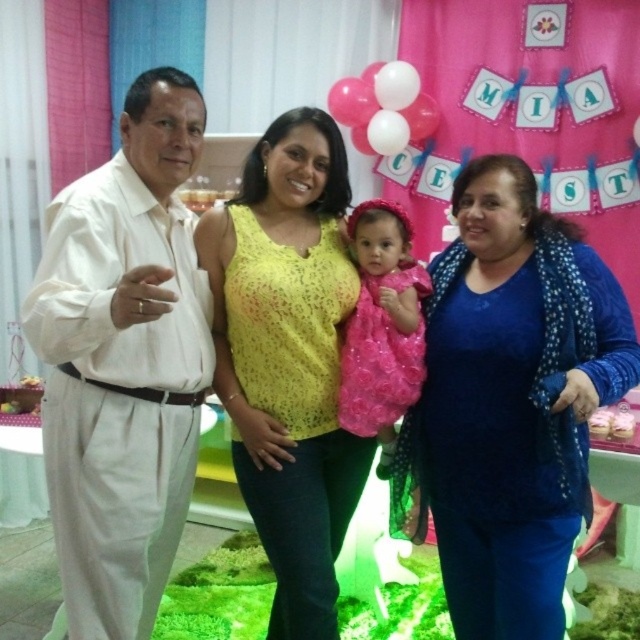
Question: Among these points, which one is nearest to the camera?

Choices:
 (A) (336, 460)
 (B) (356, 412)
 (C) (524, 168)

Answer: (C)

Question: Which of these objects is positioned farthest from the pink satin dress at center?

Choices:
 (A) blue textured sweater at center
 (B) white cotton shirt at left

Answer: (B)

Question: Does blue textured sweater at center lie behind white cotton shirt at left?

Choices:
 (A) no
 (B) yes

Answer: (B)

Question: Which point is farther from the camera taking this photo?

Choices:
 (A) (467, 186)
 (B) (138, 248)

Answer: (A)

Question: Can you confirm if white cotton shirt at left is wider than yellow lace top at center?

Choices:
 (A) no
 (B) yes

Answer: (A)

Question: Considering the relative positions of blue textured sweater at center and pink satin dress at center in the image provided, where is blue textured sweater at center located with respect to pink satin dress at center?

Choices:
 (A) left
 (B) right

Answer: (B)